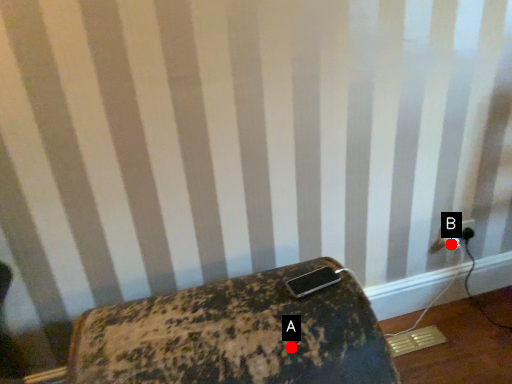
Question: Two points are circled on the image, labeled by A and B beside each circle. Which point is closer to the camera?

Choices:
 (A) A is closer
 (B) B is closer

Answer: (A)